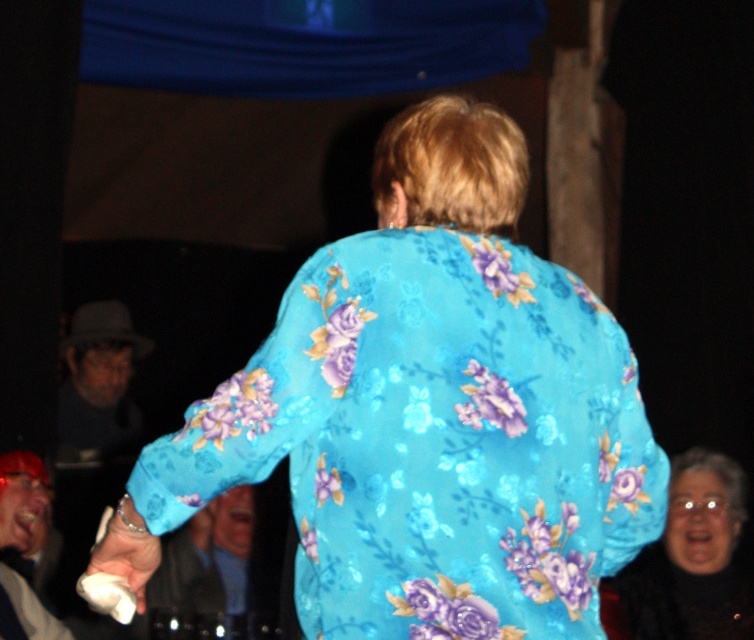
You are at the coordinates point (428, 413) in the image of the social gathering. What object is located exactly at your current position?

The floral patterned fabric at center is located at point (428, 413).